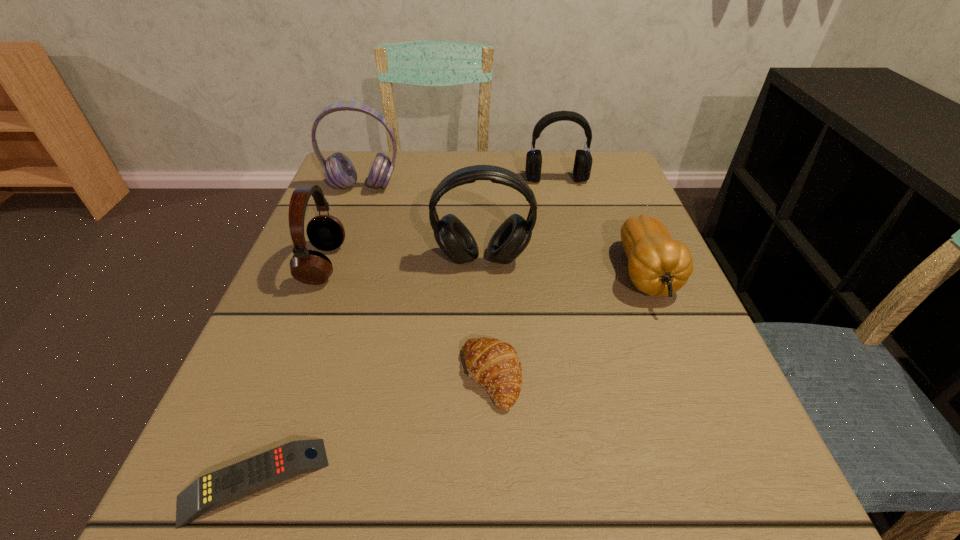
Find the location of a particular element. This screenshot has width=960, height=540. the second headset from right to left is located at coordinates (511, 238).

Identify the location of the rightmost headset. The image size is (960, 540). (582, 167).

You are a GUI agent. You are given a task and a screenshot of the screen. Output one action in this format:
    pyautogui.click(x=<x>, y=<y>)
    Task: Click on the gourd
    
    Given the screenshot: What is the action you would take?
    pyautogui.click(x=658, y=265)

You are a GUI agent. You are given a task and a screenshot of the screen. Output one action in this format:
    pyautogui.click(x=<x>, y=<y>)
    Task: Click on the sixth tallest object
    
    Given the screenshot: What is the action you would take?
    pyautogui.click(x=494, y=364)

Where is `the second nearest object`? The height and width of the screenshot is (540, 960). the second nearest object is located at coordinates (494, 364).

This screenshot has width=960, height=540. What are the coordinates of `the nearest object` in the screenshot? It's located at (224, 486).

Where is `remote control`? This screenshot has height=540, width=960. remote control is located at coordinates (224, 486).

I want to click on vacant space located 0.320m on the earcups of the third headset from left to right, so click(x=484, y=432).

You are a GUI agent. You are given a task and a screenshot of the screen. Output one action in this format:
    pyautogui.click(x=<x>, y=<y>)
    Task: Click on the vacant space located 0.050m on the headband of the rightmost headset
    This screenshot has height=540, width=960.
    Given the screenshot: What is the action you would take?
    pyautogui.click(x=561, y=198)

Identify the location of vacant space located 0.110m on the stem side of the fifth tallest object. (685, 371).